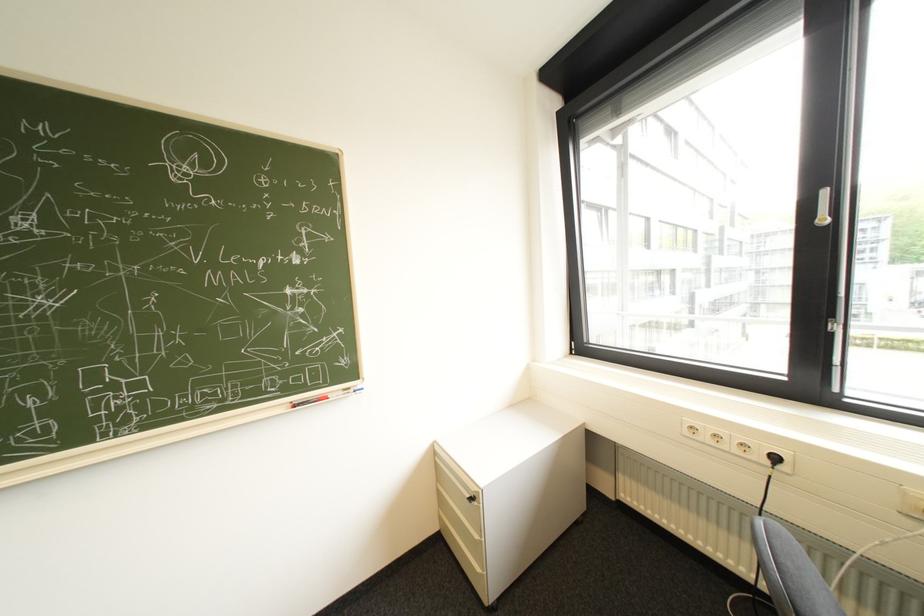
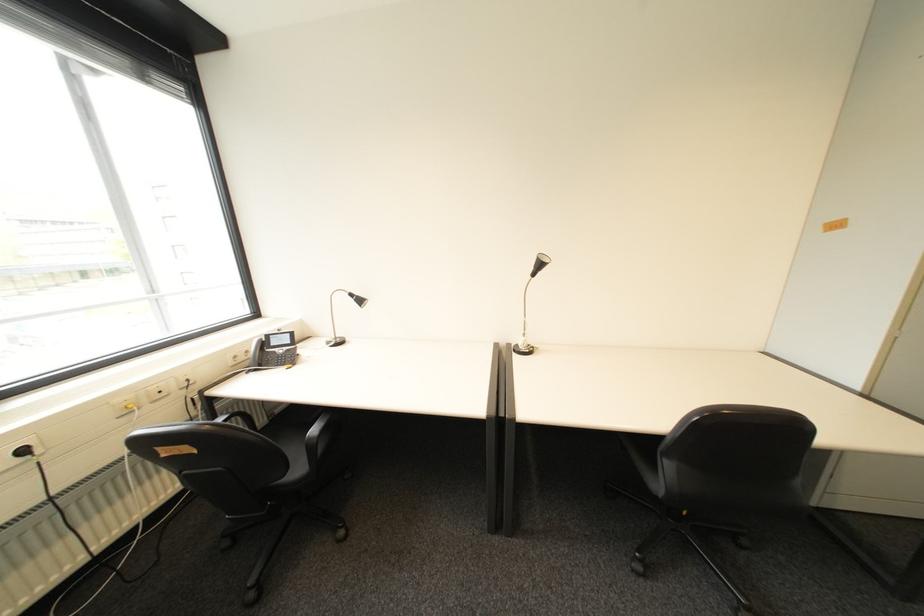
Find the pixel in the second image that matches point 785,459 in the first image.

(34, 452)